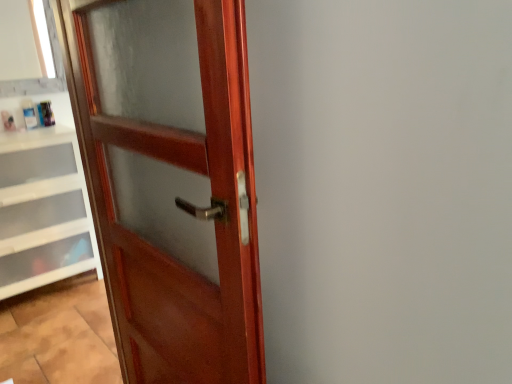
Describe the element at coordinates (42, 77) in the screenshot. I see `matte wood window frame at upper left` at that location.

Locate an element on the screen. glossy wood door at left is located at coordinates (170, 182).

At what (x,y) coordinates should I click in order to perform the action: click on matte wood window frame at upper left. Please return your answer as a coordinate pair (x, y). This screenshot has width=512, height=384. Looking at the image, I should click on (42, 77).

Is matte wood window frame at upper left directly adjacent to glossy wood door at left?

No, matte wood window frame at upper left is not in contact with glossy wood door at left.

Between matte wood window frame at upper left and glossy wood door at left, which one has smaller width?

matte wood window frame at upper left is thinner.

From a real-world perspective, is matte wood window frame at upper left positioned over glossy wood door at left based on gravity?

Indeed, from a real-world perspective, matte wood window frame at upper left stands above glossy wood door at left.

Does matte wood window frame at upper left have a greater height compared to white plastic drawers at lower left?

Incorrect, the height of matte wood window frame at upper left is not larger of that of white plastic drawers at lower left.

Where is `cabinetry located on the right of matte wood window frame at upper left`? cabinetry located on the right of matte wood window frame at upper left is located at coordinates (42, 210).

Which is in front, matte wood window frame at upper left or white plastic drawers at lower left?

white plastic drawers at lower left is closer to the camera.

Considering their positions, is glossy wood door at left located in front of or behind matte wood window frame at upper left?

In the image, glossy wood door at left appears in front of matte wood window frame at upper left.

Is glossy wood door at left completely or partially outside of matte wood window frame at upper left?

glossy wood door at left is positioned outside matte wood window frame at upper left.

Does glossy wood door at left have a larger size compared to matte wood window frame at upper left?

Correct, glossy wood door at left is larger in size than matte wood window frame at upper left.

Considering the sizes of objects glossy wood door at left and matte wood window frame at upper left in the image provided, who is thinner, glossy wood door at left or matte wood window frame at upper left?

matte wood window frame at upper left is thinner.

Looking at this image, from a real-world perspective, which object stands above the other?

matte wood window frame at upper left, from a real-world perspective.

Would you say matte wood window frame at upper left is part of white plastic drawers at lower left's contents?

No.

Based on the photo, is white plastic drawers at lower left turned away from matte wood window frame at upper left?

That's not correct — white plastic drawers at lower left is not looking away from matte wood window frame at upper left.

From the image's perspective, which one is positioned lower, white plastic drawers at lower left or matte wood window frame at upper left?

white plastic drawers at lower left appears lower in the image.

Considering their positions, is white plastic drawers at lower left located in front of or behind glossy wood door at left?

Clearly, white plastic drawers at lower left is behind glossy wood door at left.

How far apart are white plastic drawers at lower left and glossy wood door at left?

They are 1.36 meters apart.

Is white plastic drawers at lower left next to glossy wood door at left?

white plastic drawers at lower left and glossy wood door at left are not in contact.

Considering the positions of points (29, 252) and (167, 374), is point (29, 252) closer to camera compared to point (167, 374)?

No, it is not.

From the image's perspective, between glossy wood door at left and white plastic drawers at lower left, who is located below?

glossy wood door at left appears lower in the image.

Which is closer to the camera, [247,130] or [30,177]?

Point [247,130] is positioned closer to the camera compared to point [30,177].

Considering the sizes of glossy wood door at left and white plastic drawers at lower left in the image, is glossy wood door at left wider or thinner than white plastic drawers at lower left?

Considering their sizes, glossy wood door at left looks slimmer than white plastic drawers at lower left.

From their relative heights in the image, would you say glossy wood door at left is taller or shorter than white plastic drawers at lower left?

Clearly, glossy wood door at left is taller compared to white plastic drawers at lower left.

Where is `door below the matte wood window frame at upper left (from a real-world perspective)`? door below the matte wood window frame at upper left (from a real-world perspective) is located at coordinates (170, 182).

Find the location of a particular element. cabinetry in front of the matte wood window frame at upper left is located at coordinates coord(42,210).

Estimate the real-world distances between objects in this image. Which object is closer to glossy wood door at left, white plastic drawers at lower left or matte wood window frame at upper left?

The object closer to glossy wood door at left is white plastic drawers at lower left.

Based on their spatial positions, is glossy wood door at left or white plastic drawers at lower left further from matte wood window frame at upper left?

glossy wood door at left.

Which object lies nearer to the anchor point white plastic drawers at lower left, glossy wood door at left or matte wood window frame at upper left?

Among the two, matte wood window frame at upper left is located nearer to white plastic drawers at lower left.

When comparing their distances from glossy wood door at left, does matte wood window frame at upper left or white plastic drawers at lower left seem further?

The object further to glossy wood door at left is matte wood window frame at upper left.

Based on their spatial positions, is matte wood window frame at upper left or glossy wood door at left closer to white plastic drawers at lower left?

Among the two, matte wood window frame at upper left is located nearer to white plastic drawers at lower left.

From the image, which object appears to be farther from matte wood window frame at upper left, white plastic drawers at lower left or glossy wood door at left?

The object further to matte wood window frame at upper left is glossy wood door at left.

You are a GUI agent. You are given a task and a screenshot of the screen. Output one action in this format:
    pyautogui.click(x=<x>, y=<y>)
    Task: Click on the cabinetry between glossy wood door at left and matte wood window frame at upper left along the z-axis
    This screenshot has height=384, width=512.
    Given the screenshot: What is the action you would take?
    pyautogui.click(x=42, y=210)